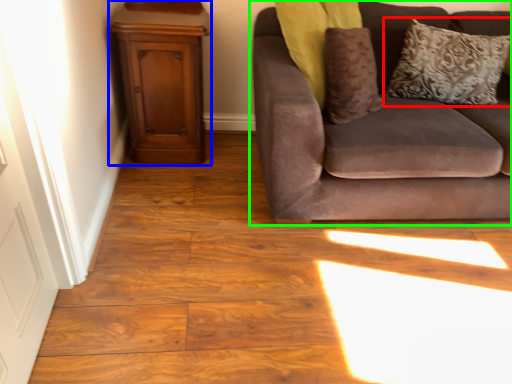
Question: Based on their relative distances, which object is farther from pillow (highlighted by a red box)? Choose from dresser (highlighted by a blue box) and studio couch (highlighted by a green box).

Choices:
 (A) dresser
 (B) studio couch

Answer: (A)